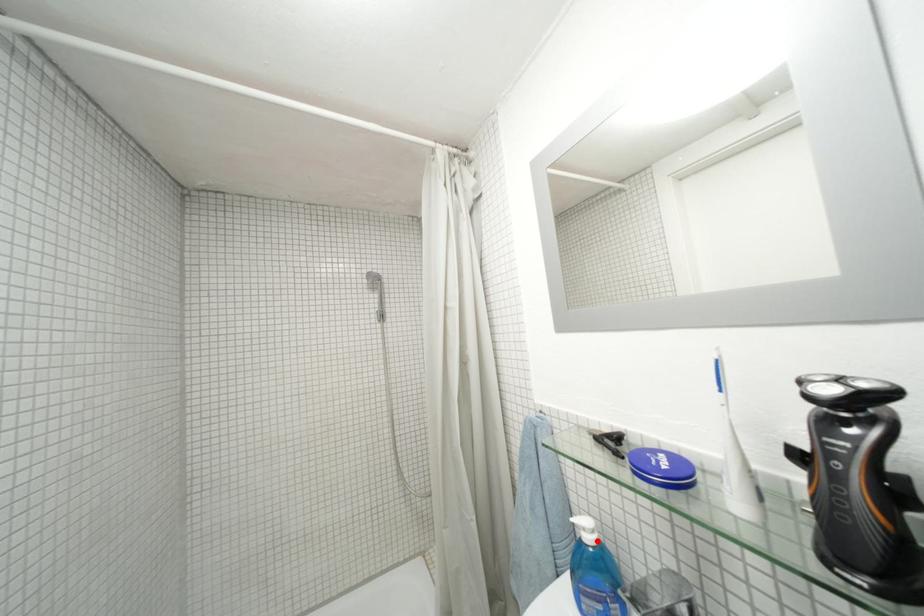
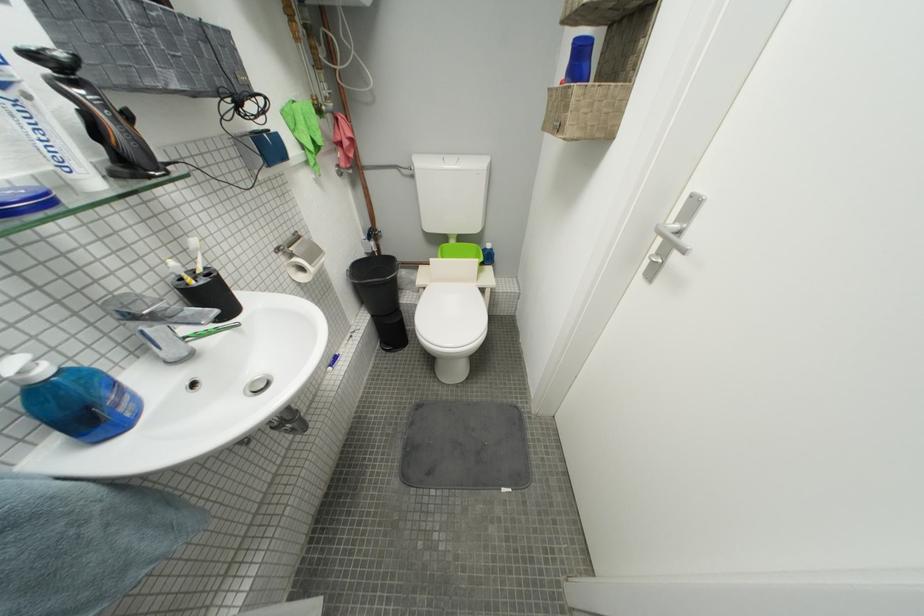
In the second image, find the point that corresponds to the highlighted location in the first image.

(53, 374)